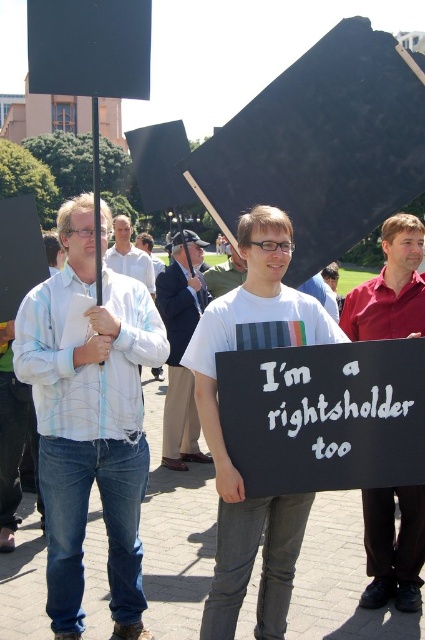
Question: Can you confirm if dark blue suit at center is positioned to the left of white shirt at center?

Choices:
 (A) yes
 (B) no

Answer: (A)

Question: Which point is farther to the camera?

Choices:
 (A) light blue striped shirt at center
 (B) white shirt at center

Answer: (B)

Question: Does white matte t-shirt at center have a lesser width compared to white shirt at center?

Choices:
 (A) yes
 (B) no

Answer: (A)

Question: Can you confirm if light blue striped shirt at center is wider than white matte t-shirt at center?

Choices:
 (A) yes
 (B) no

Answer: (A)

Question: Which point appears farthest from the camera in this image?

Choices:
 (A) (272, 298)
 (B) (192, 426)

Answer: (B)

Question: Which is nearer to the white matte t-shirt at center?

Choices:
 (A) light blue striped shirt at center
 (B) dark blue suit at center

Answer: (A)